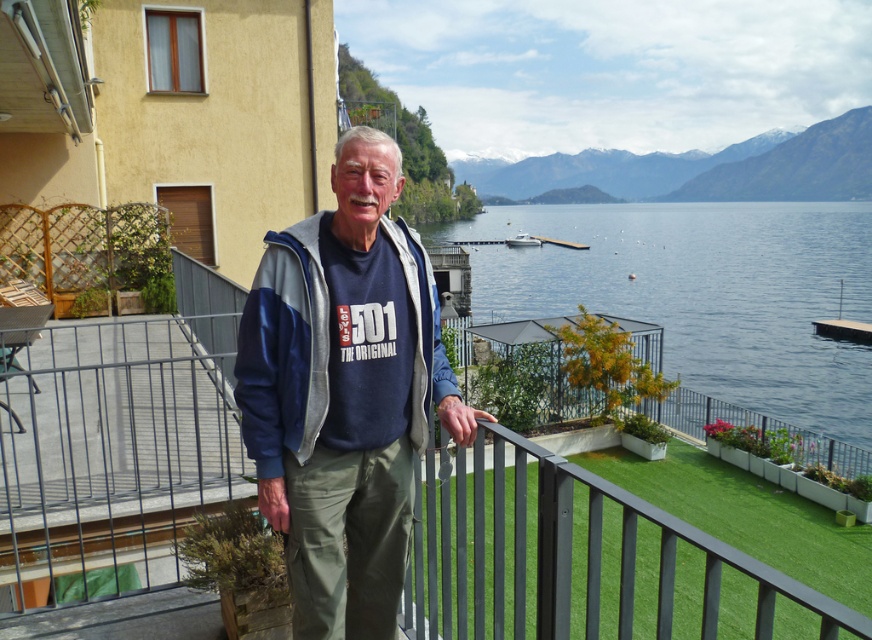
Question: Is blue water at center smaller than blue fleece sweatshirt at center?

Choices:
 (A) no
 (B) yes

Answer: (A)

Question: Which is nearer to the white glossy boat at center?

Choices:
 (A) blue water at center
 (B) matte blue jacket at center

Answer: (A)

Question: Which of the following is the farthest from the observer?

Choices:
 (A) white glossy boat at center
 (B) matte blue jacket at center

Answer: (A)

Question: Which point is closer to the camera taking this photo?

Choices:
 (A) (353, 483)
 (B) (811, 403)
 (C) (532, 241)
 (D) (439, 387)

Answer: (A)

Question: Where is blue water at center located in relation to blue fleece sweatshirt at center in the image?

Choices:
 (A) left
 (B) right

Answer: (B)

Question: Does blue water at center lie in front of white glossy boat at center?

Choices:
 (A) yes
 (B) no

Answer: (A)